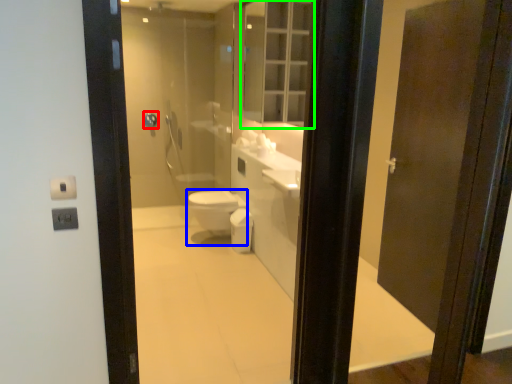
Question: Which object is positioned closest to towel bar (highlighted by a red box)? Select from bidet (highlighted by a blue box) and medicine cabinet (highlighted by a green box).

Choices:
 (A) bidet
 (B) medicine cabinet

Answer: (A)